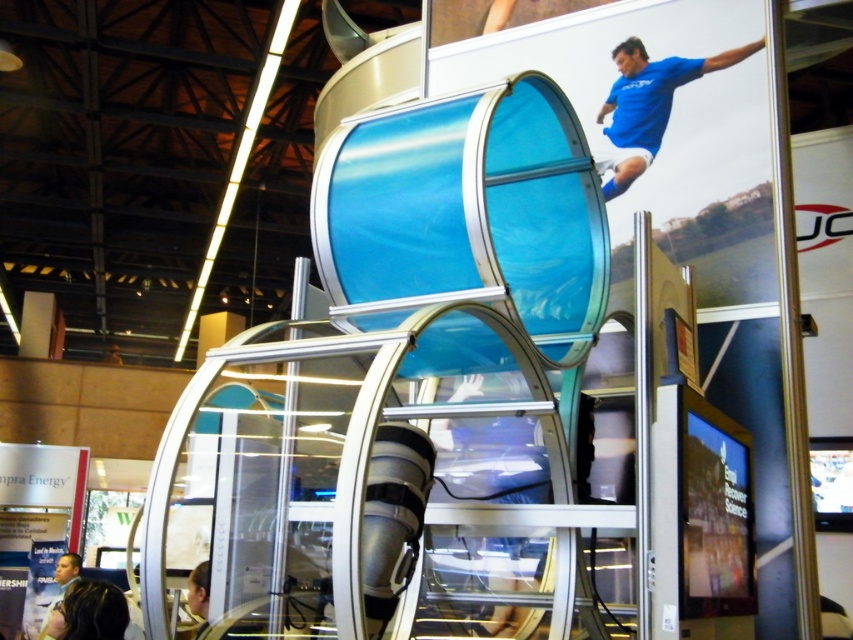
Is blue jersey at upper right behind dark brown hair at lower left?

No, blue jersey at upper right is in front of dark brown hair at lower left.

Who is lower down, blue jersey at upper right or dark brown hair at lower left?

dark brown hair at lower left is below.

Looking at this image, who is more forward, [628,58] or [91,628]?

Positioned in front is point [628,58].

Where is `blue jersey at upper right`? This screenshot has height=640, width=853. blue jersey at upper right is located at coordinates (648, 104).